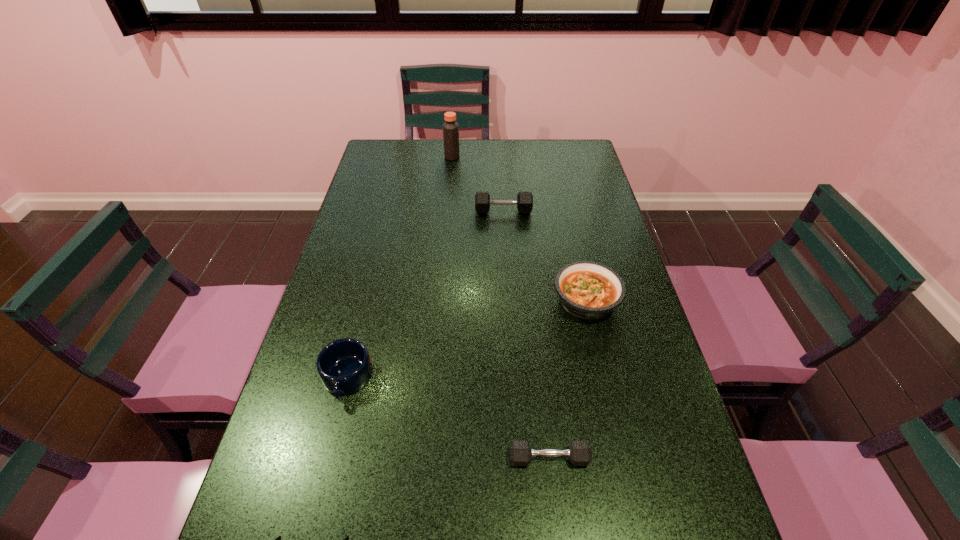
Where is `the farthest object`? This screenshot has width=960, height=540. the farthest object is located at coordinates (450, 128).

What are the coordinates of `the tallest object` in the screenshot? It's located at (450, 128).

The image size is (960, 540). Find the location of `the taller dumbbell`. the taller dumbbell is located at coordinates (524, 201).

The height and width of the screenshot is (540, 960). What are the coordinates of `the second farthest object` in the screenshot? It's located at (524, 201).

The height and width of the screenshot is (540, 960). I want to click on mug, so click(x=344, y=366).

The width and height of the screenshot is (960, 540). In order to click on the third farthest object in this screenshot , I will do `click(589, 290)`.

This screenshot has height=540, width=960. Find the location of `the nearer dumbbell`. the nearer dumbbell is located at coordinates (580, 454).

This screenshot has height=540, width=960. I want to click on the second nearest object, so click(x=580, y=454).

In order to click on free spot located on the front of the farthest object in this screenshot , I will do `click(449, 191)`.

The width and height of the screenshot is (960, 540). Identify the location of blank space located 0.330m on the back of the second farthest object. (500, 157).